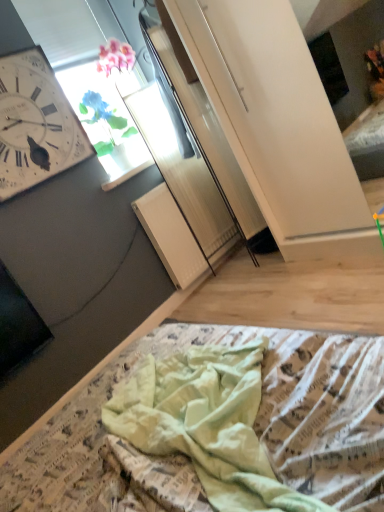
Question: Does transparent glass window at upper center appear on the right side of white wooden wall clock at upper left?

Choices:
 (A) no
 (B) yes

Answer: (B)

Question: Can you confirm if transparent glass window at upper center is thinner than white wooden wall clock at upper left?

Choices:
 (A) yes
 (B) no

Answer: (B)

Question: From a real-world perspective, does transparent glass window at upper center stand above white wooden wall clock at upper left?

Choices:
 (A) yes
 (B) no

Answer: (B)

Question: Considering the relative sizes of transparent glass window at upper center and white wooden wall clock at upper left in the image provided, is transparent glass window at upper center wider than white wooden wall clock at upper left?

Choices:
 (A) no
 (B) yes

Answer: (B)

Question: Can you confirm if transparent glass window at upper center is smaller than white wooden wall clock at upper left?

Choices:
 (A) no
 (B) yes

Answer: (A)

Question: Is light green fabric at lower center taller or shorter than white wooden wall clock at upper left?

Choices:
 (A) tall
 (B) short

Answer: (B)

Question: Is light green fabric at lower center inside or outside of white wooden wall clock at upper left?

Choices:
 (A) outside
 (B) inside

Answer: (A)

Question: In terms of width, does light green fabric at lower center look wider or thinner when compared to white wooden wall clock at upper left?

Choices:
 (A) wide
 (B) thin

Answer: (A)

Question: Considering their positions, is light green fabric at lower center located in front of or behind white wooden wall clock at upper left?

Choices:
 (A) behind
 (B) front

Answer: (B)

Question: Is light green fabric at lower center taller or shorter than transparent glass window at upper center?

Choices:
 (A) short
 (B) tall

Answer: (A)

Question: From a real-world perspective, is light green fabric at lower center physically located above or below transparent glass window at upper center?

Choices:
 (A) above
 (B) below

Answer: (B)

Question: Based on their positions, is light green fabric at lower center located to the left or right of transparent glass window at upper center?

Choices:
 (A) right
 (B) left

Answer: (A)

Question: Relative to transparent glass window at upper center, is light green fabric at lower center in front or behind?

Choices:
 (A) behind
 (B) front

Answer: (B)

Question: Is white wooden wall clock at upper left spatially inside transparent glass window at upper center, or outside of it?

Choices:
 (A) outside
 (B) inside

Answer: (A)

Question: Considering the positions of white wooden wall clock at upper left and transparent glass window at upper center in the image, is white wooden wall clock at upper left taller or shorter than transparent glass window at upper center?

Choices:
 (A) short
 (B) tall

Answer: (B)